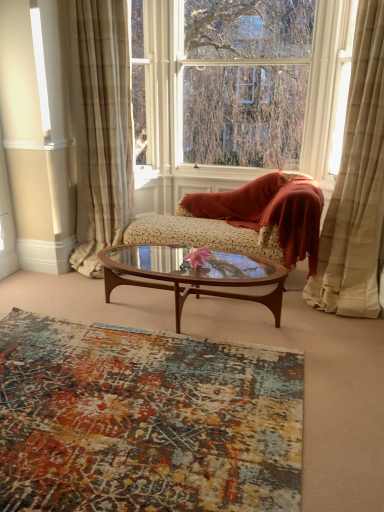
Question: Is beige textured curtain at right, which is the first curtain in right-to-left order, facing towards textured multicolored rug at lower center?

Choices:
 (A) no
 (B) yes

Answer: (A)

Question: Is beige textured curtain at right, which is the first curtain in right-to-left order, behind textured multicolored rug at lower center?

Choices:
 (A) yes
 (B) no

Answer: (A)

Question: Is beige textured curtain at right, which is the first curtain in right-to-left order, shorter than textured multicolored rug at lower center?

Choices:
 (A) no
 (B) yes

Answer: (A)

Question: Is beige textured curtain at right, which is the first curtain in right-to-left order, at the right side of textured multicolored rug at lower center?

Choices:
 (A) no
 (B) yes

Answer: (B)

Question: Does beige textured curtain at right, which is the first curtain in right-to-left order, appear on the left side of textured multicolored rug at lower center?

Choices:
 (A) yes
 (B) no

Answer: (B)

Question: From the image's perspective, does beige textured curtain at right, acting as the second curtain starting from the left, appear higher than textured multicolored rug at lower center?

Choices:
 (A) no
 (B) yes

Answer: (B)

Question: Does clear glass window at upper center have a smaller size compared to beige plaid curtain at left, the first curtain from the left?

Choices:
 (A) yes
 (B) no

Answer: (A)

Question: From a real-world perspective, is clear glass window at upper center under beige plaid curtain at left, which is the second curtain from right to left?

Choices:
 (A) yes
 (B) no

Answer: (B)

Question: Is clear glass window at upper center located outside beige plaid curtain at left, which is the second curtain from right to left?

Choices:
 (A) no
 (B) yes

Answer: (B)

Question: Does clear glass window at upper center have a lesser height compared to beige plaid curtain at left, which is the second curtain from right to left?

Choices:
 (A) no
 (B) yes

Answer: (B)

Question: Is there a large distance between clear glass window at upper center and beige plaid curtain at left, which is the second curtain from right to left?

Choices:
 (A) yes
 (B) no

Answer: (B)

Question: Is beige plaid curtain at left, the first curtain from the left, at the back of clear glass window at upper center?

Choices:
 (A) no
 (B) yes

Answer: (A)

Question: Is velvet floral-patterned chaise lounge at center behind textured multicolored rug at lower center?

Choices:
 (A) no
 (B) yes

Answer: (B)